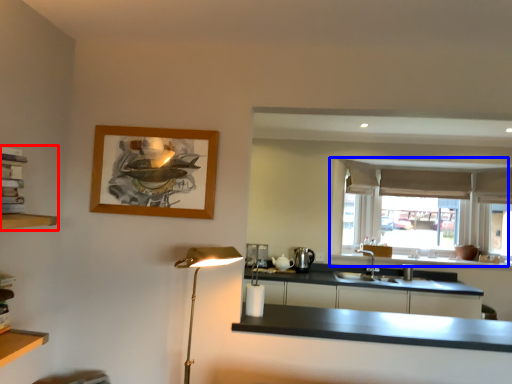
Question: Which object is closer to the camera taking this photo, shelf (highlighted by a red box) or window (highlighted by a blue box)?

Choices:
 (A) shelf
 (B) window

Answer: (A)